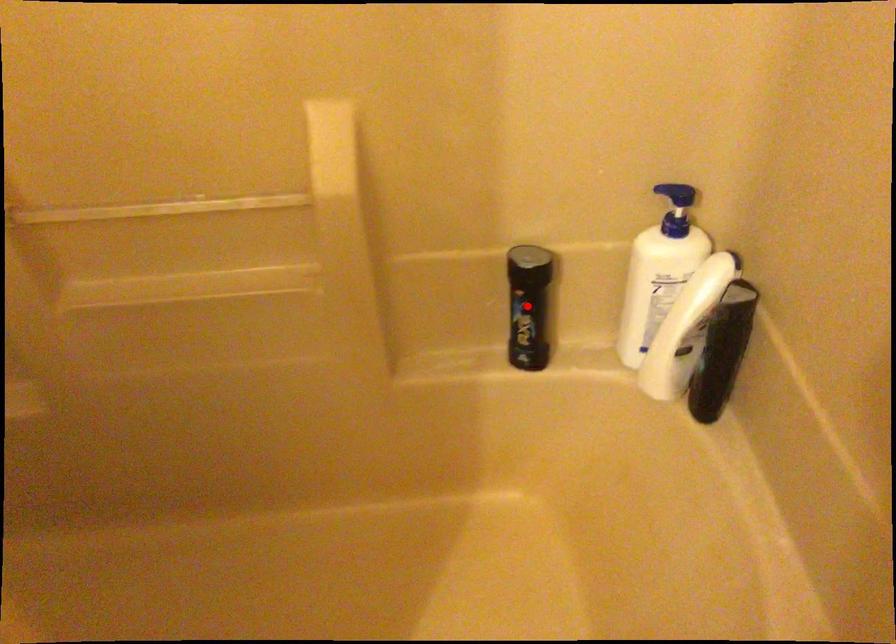
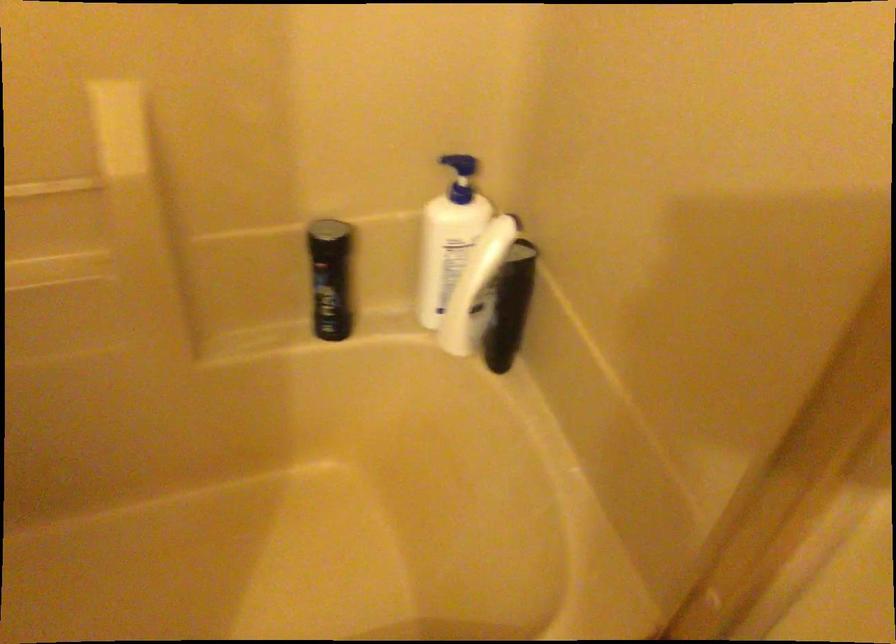
Where in the second image is the point corresponding to the highlighted location from the first image?

(330, 278)